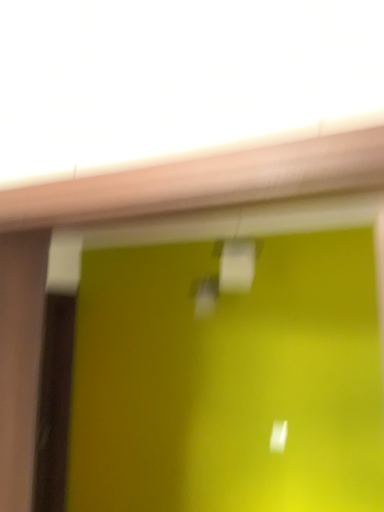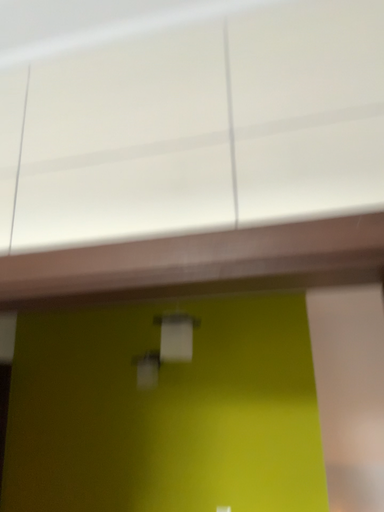
Question: How did the camera likely rotate when shooting the video?

Choices:
 (A) rotated left
 (B) rotated right

Answer: (B)